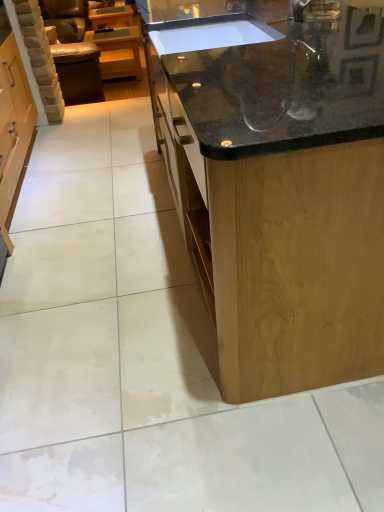
What do you see at coordinates (117, 42) in the screenshot?
I see `matte wood cabinet at upper left` at bounding box center [117, 42].

Where is `black granite countertop at center, arranged as the first countertop when viewed from the front`? The height and width of the screenshot is (512, 384). black granite countertop at center, arranged as the first countertop when viewed from the front is located at coordinates (277, 181).

You are a GUI agent. You are given a task and a screenshot of the screen. Output one action in this format:
    pyautogui.click(x=<x>, y=<y>)
    Task: Click on the leather armchair at left
    This screenshot has height=512, width=384.
    Given the screenshot: What is the action you would take?
    pyautogui.click(x=73, y=54)

Measure the distance between matte wood cabinet at upper left and leather armchair at left.

matte wood cabinet at upper left and leather armchair at left are 8.31 inches apart from each other.

Can you tell me how much matte wood cabinet at upper left and leather armchair at left differ in facing direction?

They differ by 17.5 degrees in their facing directions.

Is matte wood cabinet at upper left far away from leather armchair at left?

No, matte wood cabinet at upper left is in close proximity to leather armchair at left.

Is matte wood cabinet at upper left turned away from leather armchair at left?

No.

From the image's perspective, is black granite countertop at center, which appears as the 2th countertop when viewed from the front, below matte wood cabinet at upper left?

Indeed, from the image's perspective, black granite countertop at center, which appears as the 2th countertop when viewed from the front, is shown beneath matte wood cabinet at upper left.

In the image, is black granite countertop at center, acting as the first countertop starting from the back, positioned in front of or behind matte wood cabinet at upper left?

Clearly, black granite countertop at center, acting as the first countertop starting from the back, is in front of matte wood cabinet at upper left.

From a real-world perspective, is black granite countertop at center, acting as the first countertop starting from the back, physically located above or below matte wood cabinet at upper left?

From a real-world perspective, black granite countertop at center, acting as the first countertop starting from the back, is physically above matte wood cabinet at upper left.

Does point (199, 148) come in front of point (135, 41)?

Yes, it is in front of point (135, 41).

Are leather armchair at left and black granite countertop at center, acting as the first countertop starting from the back, making contact?

They are not placed beside each other.

What's the angular difference between leather armchair at left and black granite countertop at center, acting as the first countertop starting from the back,'s facing directions?

There is a 163-degree angle between the facing directions of leather armchair at left and black granite countertop at center, acting as the first countertop starting from the back.

Which of these two, leather armchair at left or black granite countertop at center, acting as the first countertop starting from the back, stands shorter?

black granite countertop at center, acting as the first countertop starting from the back, is shorter.

Which is more to the left, black granite countertop at center, acting as the first countertop starting from the back, or leather armchair at left?

From the viewer's perspective, leather armchair at left appears more on the left side.

From the picture: Considering the sizes of objects black granite countertop at center, which appears as the 2th countertop when viewed from the front, and leather armchair at left in the image provided, who is wider, black granite countertop at center, which appears as the 2th countertop when viewed from the front, or leather armchair at left?

black granite countertop at center, which appears as the 2th countertop when viewed from the front.

Is point (313, 106) farther from viewer compared to point (69, 58)?

No, (313, 106) is closer to viewer.

Would you say matte wood cabinet at upper left contains black granite countertop at center, marked as the 2th countertop in a back-to-front arrangement?

Definitely not — black granite countertop at center, marked as the 2th countertop in a back-to-front arrangement, is not inside matte wood cabinet at upper left.

Which object is further away from the camera, matte wood cabinet at upper left or black granite countertop at center, arranged as the first countertop when viewed from the front?

Positioned behind is matte wood cabinet at upper left.

Which is more to the right, matte wood cabinet at upper left or black granite countertop at center, arranged as the first countertop when viewed from the front?

black granite countertop at center, arranged as the first countertop when viewed from the front, is more to the right.

Between matte wood cabinet at upper left and black granite countertop at center, acting as the first countertop starting from the back, which one has less height?

With less height is black granite countertop at center, acting as the first countertop starting from the back.

From a real-world perspective, is matte wood cabinet at upper left located beneath black granite countertop at center, which appears as the 2th countertop when viewed from the front?

Yes, from a real-world perspective, matte wood cabinet at upper left is under black granite countertop at center, which appears as the 2th countertop when viewed from the front.

From a real-world perspective, which countertop is the 2nd one above the matte wood cabinet at upper left? Please provide its 2D coordinates.

[(269, 72)]

Relative to black granite countertop at center, which appears as the 2th countertop when viewed from the front, is matte wood cabinet at upper left in front or behind?

matte wood cabinet at upper left is positioned farther from the viewer than black granite countertop at center, which appears as the 2th countertop when viewed from the front.

Does black granite countertop at center, marked as the 2th countertop in a back-to-front arrangement, turn towards black granite countertop at center, which appears as the 2th countertop when viewed from the front?

No, black granite countertop at center, marked as the 2th countertop in a back-to-front arrangement, is not turned towards black granite countertop at center, which appears as the 2th countertop when viewed from the front.

Is black granite countertop at center, marked as the 2th countertop in a back-to-front arrangement, next to black granite countertop at center, which appears as the 2th countertop when viewed from the front, and touching it?

black granite countertop at center, marked as the 2th countertop in a back-to-front arrangement, and black granite countertop at center, which appears as the 2th countertop when viewed from the front, are clearly separated.

Looking at their sizes, would you say black granite countertop at center, marked as the 2th countertop in a back-to-front arrangement, is wider or thinner than black granite countertop at center, acting as the first countertop starting from the back?

Considering their sizes, black granite countertop at center, marked as the 2th countertop in a back-to-front arrangement, looks broader than black granite countertop at center, acting as the first countertop starting from the back.

Can you tell me how much black granite countertop at center, marked as the 2th countertop in a back-to-front arrangement, and black granite countertop at center, which appears as the 2th countertop when viewed from the front, differ in facing direction?

178 degrees separate the facing orientations of black granite countertop at center, marked as the 2th countertop in a back-to-front arrangement, and black granite countertop at center, which appears as the 2th countertop when viewed from the front.

I want to click on armchair that appears on the left of matte wood cabinet at upper left, so click(x=73, y=54).

Identify the location of the 1st countertop in front of the matte wood cabinet at upper left, starting your count from the anchor. (269, 72).

Based on their spatial positions, is leather armchair at left or black granite countertop at center, marked as the 2th countertop in a back-to-front arrangement, further from black granite countertop at center, which appears as the 2th countertop when viewed from the front?

→ leather armchair at left is further to black granite countertop at center, which appears as the 2th countertop when viewed from the front.

Looking at the image, which one is located closer to black granite countertop at center, acting as the first countertop starting from the back, leather armchair at left or matte wood cabinet at upper left?

matte wood cabinet at upper left is positioned closer to the anchor black granite countertop at center, acting as the first countertop starting from the back.

From the image, which object appears to be farther from black granite countertop at center, marked as the 2th countertop in a back-to-front arrangement, leather armchair at left or black granite countertop at center, acting as the first countertop starting from the back?

The object further to black granite countertop at center, marked as the 2th countertop in a back-to-front arrangement, is leather armchair at left.

Looking at the image, which one is located closer to black granite countertop at center, acting as the first countertop starting from the back, matte wood cabinet at upper left or leather armchair at left?

Based on the image, matte wood cabinet at upper left appears to be nearer to black granite countertop at center, acting as the first countertop starting from the back.

Looking at the image, which one is located closer to matte wood cabinet at upper left, black granite countertop at center, acting as the first countertop starting from the back, or black granite countertop at center, marked as the 2th countertop in a back-to-front arrangement?

The object closer to matte wood cabinet at upper left is black granite countertop at center, acting as the first countertop starting from the back.

Estimate the real-world distances between objects in this image. Which object is closer to leather armchair at left, black granite countertop at center, which appears as the 2th countertop when viewed from the front, or black granite countertop at center, arranged as the first countertop when viewed from the front?

black granite countertop at center, which appears as the 2th countertop when viewed from the front.

Based on their spatial positions, is leather armchair at left or black granite countertop at center, which appears as the 2th countertop when viewed from the front, further from matte wood cabinet at upper left?

black granite countertop at center, which appears as the 2th countertop when viewed from the front.

When comparing their distances from matte wood cabinet at upper left, does leather armchair at left or black granite countertop at center, arranged as the first countertop when viewed from the front, seem closer?

leather armchair at left is positioned closer to the anchor matte wood cabinet at upper left.

The width and height of the screenshot is (384, 512). Identify the location of armchair between black granite countertop at center, which appears as the 2th countertop when viewed from the front, and matte wood cabinet at upper left in the front-back direction. (73, 54).

Where is `countertop between black granite countertop at center, marked as the 2th countertop in a back-to-front arrangement, and matte wood cabinet at upper left, along the z-axis`? Image resolution: width=384 pixels, height=512 pixels. countertop between black granite countertop at center, marked as the 2th countertop in a back-to-front arrangement, and matte wood cabinet at upper left, along the z-axis is located at coordinates (269, 72).

This screenshot has height=512, width=384. What are the coordinates of `armchair between black granite countertop at center, marked as the 2th countertop in a back-to-front arrangement, and matte wood cabinet at upper left in the front-back direction` in the screenshot? It's located at (x=73, y=54).

Find the location of a particular element. The height and width of the screenshot is (512, 384). countertop located between black granite countertop at center, marked as the 2th countertop in a back-to-front arrangement, and leather armchair at left in the depth direction is located at coordinates (269, 72).